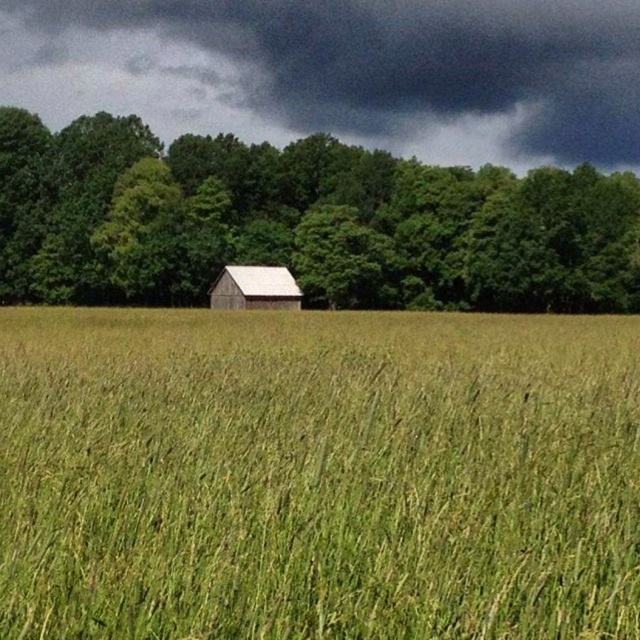
Question: Can you confirm if green grassy wheat field at center is bigger than green matte tree at center?

Choices:
 (A) yes
 (B) no

Answer: (B)

Question: Observing the image, what is the correct spatial positioning of green grassy wheat field at center in reference to white wooden barn at center?

Choices:
 (A) above
 (B) below

Answer: (B)

Question: Considering the real-world distances, which object is closest to the dark gray cloud at upper center?

Choices:
 (A) green grassy wheat field at center
 (B) white wooden barn at center
 (C) green matte tree at center

Answer: (C)

Question: Which of these objects is positioned closest to the green matte tree at center?

Choices:
 (A) green grassy wheat field at center
 (B) white wooden barn at center
 (C) dark gray cloud at upper center

Answer: (B)

Question: Does green matte tree at center lie behind white wooden barn at center?

Choices:
 (A) yes
 (B) no

Answer: (B)

Question: Which point is closer to the camera taking this photo?

Choices:
 (A) (272, 288)
 (B) (3, 100)
 (C) (250, 422)
 (D) (552, 237)

Answer: (C)